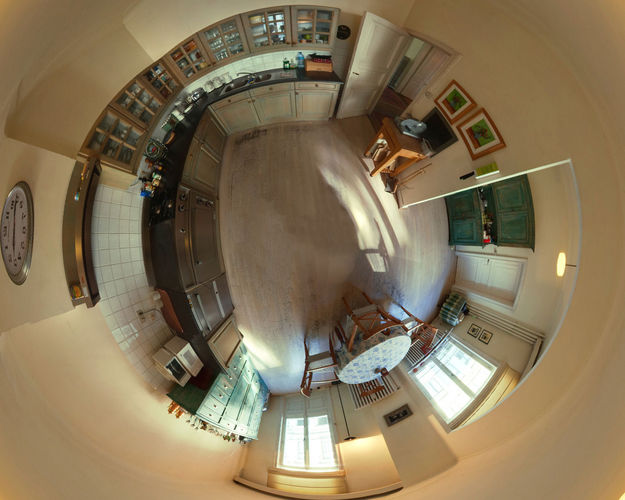
I want to click on cabinet, so click(x=238, y=412), click(x=475, y=212), click(x=204, y=151), click(x=270, y=100), click(x=204, y=262), click(x=228, y=342).